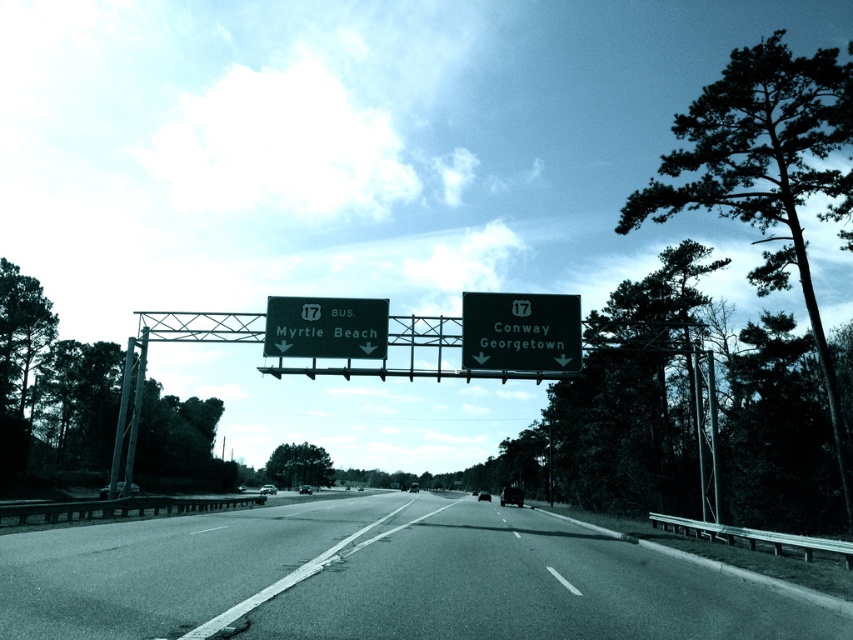
You are a drone operator trying to capture aerial footage of the highway. You notice two points marked on your map corresponding to coordinates point (x=173, y=634) and point (x=325, y=307). Which point should you prioritize if you want to film the guardrail along the right side of the road from a closer perspective?

Point (x=173, y=634) is closer to the camera than point (x=325, y=307), so you should prioritize filming the guardrail along the right side of the road from point (x=173, y=634) for a closer perspective.

Consider the image. You are a self driving car navigating the highway. You need to stay on the asphalt road at center. Where should you position your vehicle to stay on the road?

The asphalt road at center is located at point 2D coordinates of (376, 579), so the vehicle should position itself at those coordinates to stay on the road.